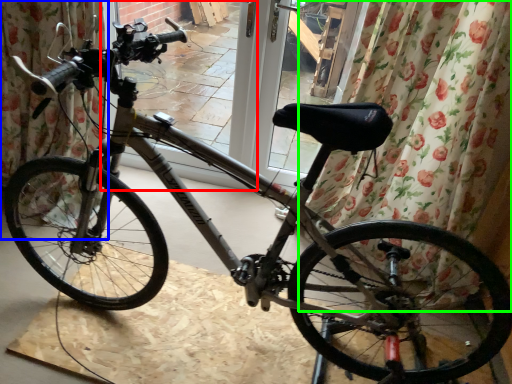
Question: Which is nearer to the screen door (highlighted by a red box)? curtain (highlighted by a blue box) or curtain (highlighted by a green box).

Choices:
 (A) curtain
 (B) curtain

Answer: (A)